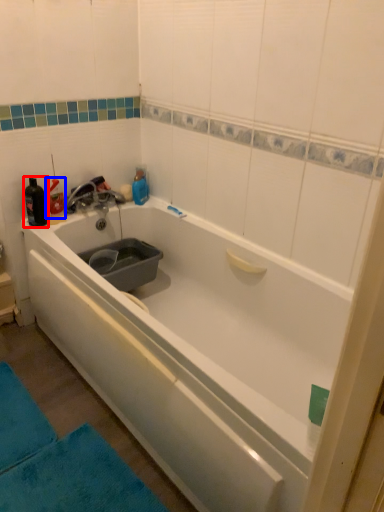
Question: Which of the following is the farthest to the observer, bottle (highlighted by a red box) or bottle (highlighted by a blue box)?

Choices:
 (A) bottle
 (B) bottle

Answer: (B)